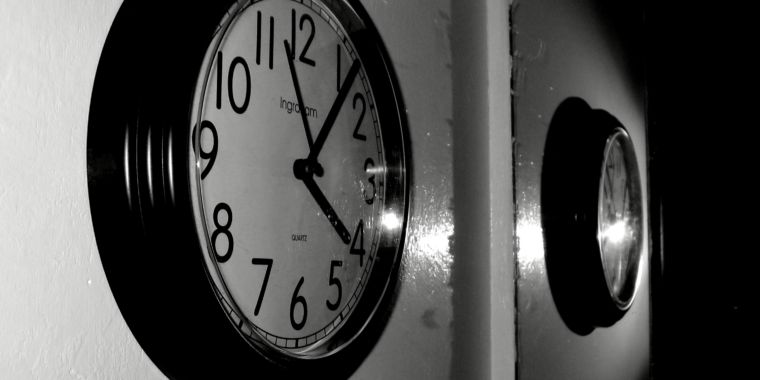
Where is `covering for clock face`? The width and height of the screenshot is (760, 380). covering for clock face is located at coordinates (325, 270), (619, 248).